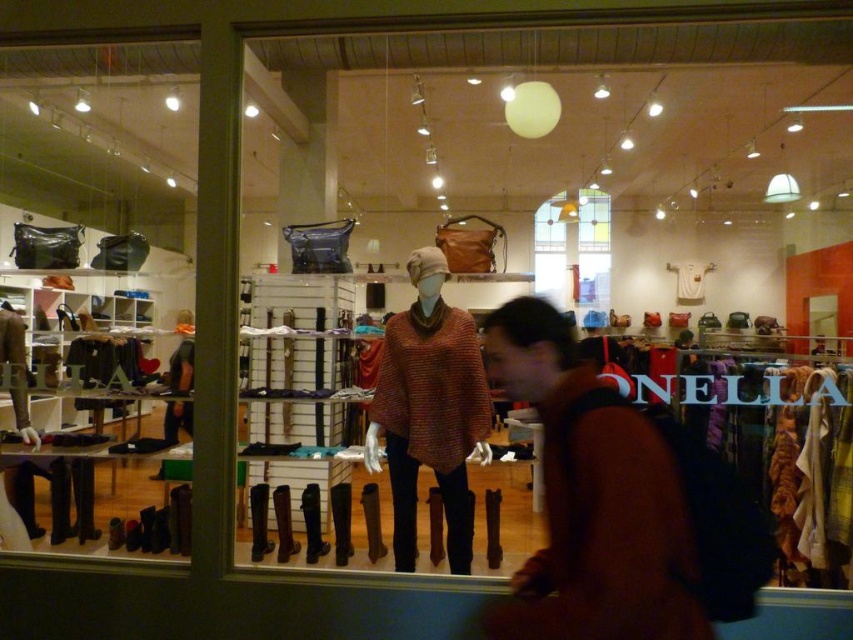
Does matte black boots at lower left have a smaller size compared to knitwear sweater at center?

Actually, matte black boots at lower left might be larger than knitwear sweater at center.

Which is in front, point (108, 240) or point (408, 468)?

Point (408, 468) is more forward.

Which is in front, point (140, 172) or point (408, 372)?

Point (408, 372) is more forward.

Find the location of `matte black boots at lower left`. matte black boots at lower left is located at coordinates (96, 291).

Is matte black boots at lower left wider than brown wool sweater at center?

Correct, the width of matte black boots at lower left exceeds that of brown wool sweater at center.

Does matte black boots at lower left have a larger size compared to brown wool sweater at center?

Indeed, matte black boots at lower left has a larger size compared to brown wool sweater at center.

What do you see at coordinates (96, 291) in the screenshot? This screenshot has width=853, height=640. I see `matte black boots at lower left` at bounding box center [96, 291].

The width and height of the screenshot is (853, 640). Identify the location of matte black boots at lower left. (96, 291).

Can you confirm if brown wool sweater at center is thinner than knitwear sweater at center?

Yes, brown wool sweater at center is thinner than knitwear sweater at center.

Is brown wool sweater at center to the left of knitwear sweater at center from the viewer's perspective?

In fact, brown wool sweater at center is to the right of knitwear sweater at center.

Who is more forward, (560, 561) or (479, 356)?

Positioned in front is point (560, 561).

Identify the location of brown wool sweater at center. (590, 499).